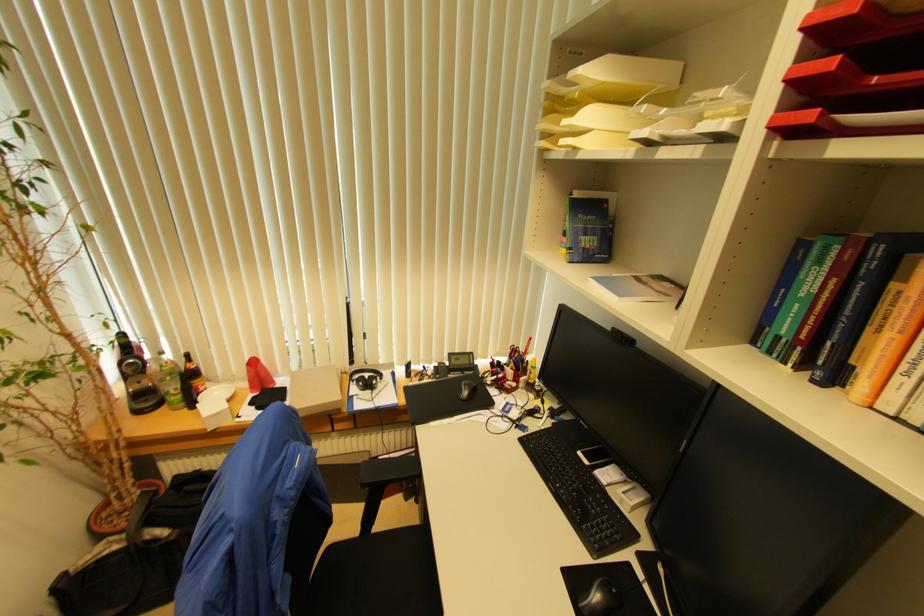
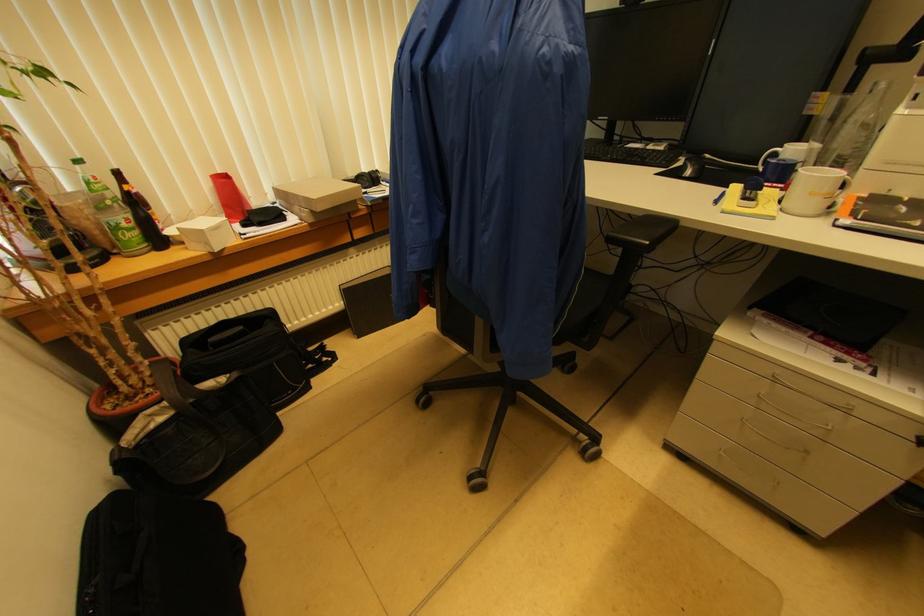
Locate, in the second image, the point that corresponds to point (180, 389) in the first image.

(131, 219)